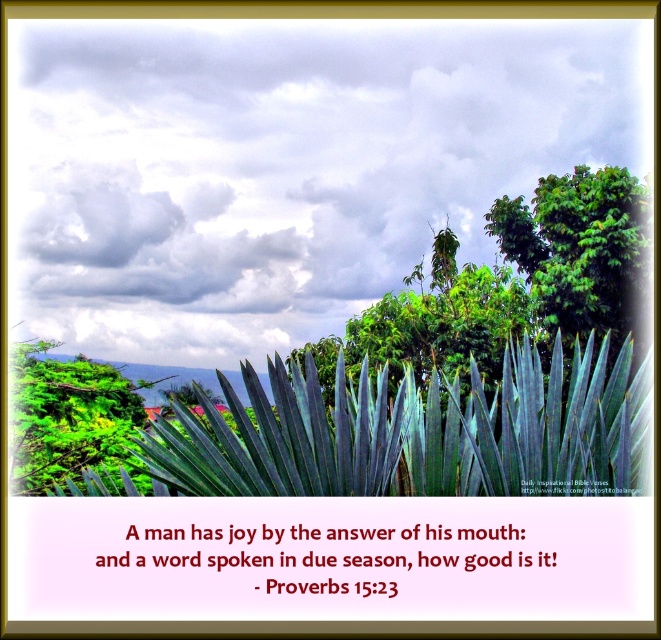
Question: In this image, where is blue-green leafy plant at center located relative to green leafy tree at upper right?

Choices:
 (A) below
 (B) above

Answer: (A)

Question: Is blue-green leafy plant at center to the right of green leafy tree at upper right from the viewer's perspective?

Choices:
 (A) yes
 (B) no

Answer: (B)

Question: Estimate the real-world distances between objects in this image. Which object is farther from the green leafy tree at upper right?

Choices:
 (A) blue-green leafy plant at center
 (B) cloudy sky at upper center

Answer: (A)

Question: Which of these objects is positioned closest to the blue-green leafy plant at center?

Choices:
 (A) cloudy sky at upper center
 (B) green leafy tree at upper right

Answer: (A)

Question: Which point is farther from the camera taking this photo?

Choices:
 (A) (436, 486)
 (B) (617, 276)
 (C) (602, 154)

Answer: (C)

Question: Where is blue-green leafy plant at center located in relation to green leafy tree at upper right in the image?

Choices:
 (A) below
 (B) above

Answer: (A)